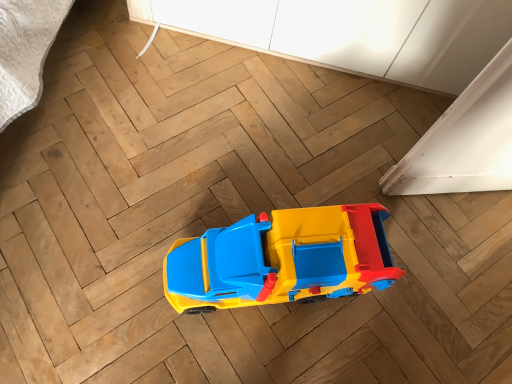
What are the coordinates of `vacant area on top of matte plastic toy car at center (from a real-world perspective)` in the screenshot? It's located at (325, 237).